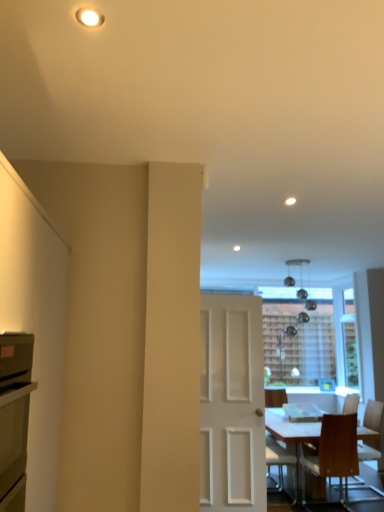
Question: Would you say wooden chair at lower right, marked as the first chair in a right-to-left arrangement, is inside or outside wooden chair at lower right, positioned as the 2th chair in right-to-left order?

Choices:
 (A) outside
 (B) inside

Answer: (A)

Question: Looking at their shapes, would you say wooden chair at lower right, which is the third chair in left-to-right order, is wider or thinner than wooden chair at lower right, positioned as the 2th chair in right-to-left order?

Choices:
 (A) thin
 (B) wide

Answer: (B)

Question: Considering the real-world distances, which object is farthest from the wooden chair at lower right, marked as the first chair in a right-to-left arrangement?

Choices:
 (A) matte black oven at left
 (B) wooden chair at lower right, placed as the 3th chair when sorted from right to left
 (C) white matte door at center
 (D) wooden chair at lower right, positioned as the 2th chair in right-to-left order

Answer: (A)

Question: Which is nearer to the matte black oven at left?

Choices:
 (A) wooden chair at lower right, which is the first chair in left-to-right order
 (B) wooden chair at lower right, marked as the first chair in a right-to-left arrangement
 (C) white matte door at center
 (D) wooden chair at lower right, which is counted as the 2th chair, starting from the left

Answer: (C)